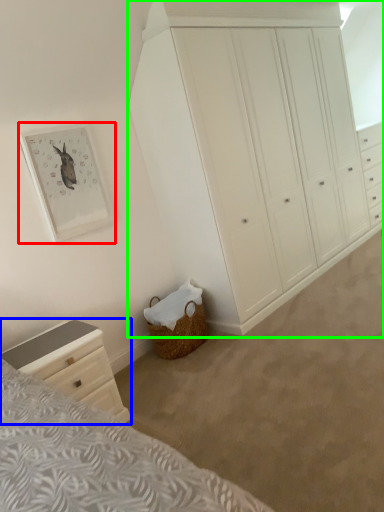
Question: Based on their relative distances, which object is nearer to picture frame (highlighted by a red box)? Choose from chest of drawers (highlighted by a blue box) and chest of drawers (highlighted by a green box).

Choices:
 (A) chest of drawers
 (B) chest of drawers

Answer: (A)